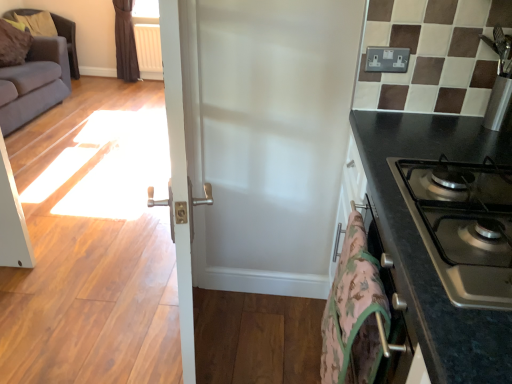
Find the location of a particular element. free spot behind white glossy door at center is located at coordinates (196, 312).